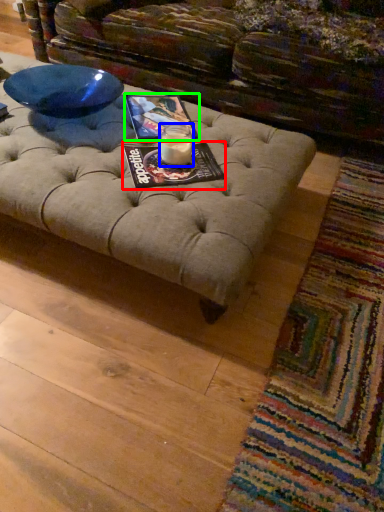
Question: Considering the real-world distances, which object is farthest from magazine (highlighted by a red box)? candle holder (highlighted by a blue box) or magazine (highlighted by a green box)?

Choices:
 (A) candle holder
 (B) magazine

Answer: (B)